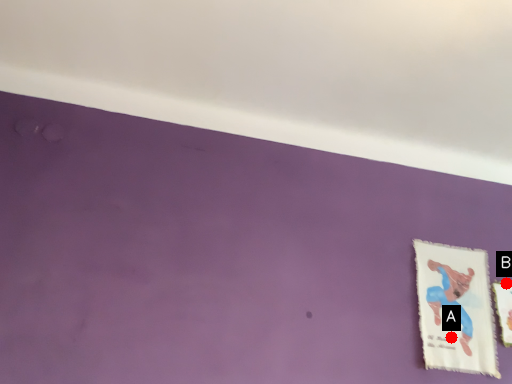
Question: Two points are circled on the image, labeled by A and B beside each circle. Which point is further to the camera?

Choices:
 (A) A is further
 (B) B is further

Answer: (B)